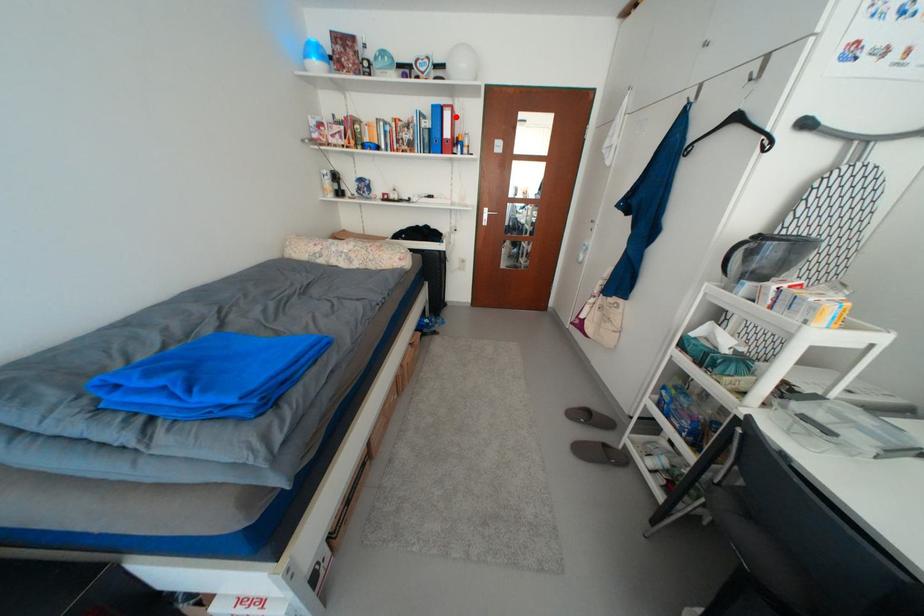
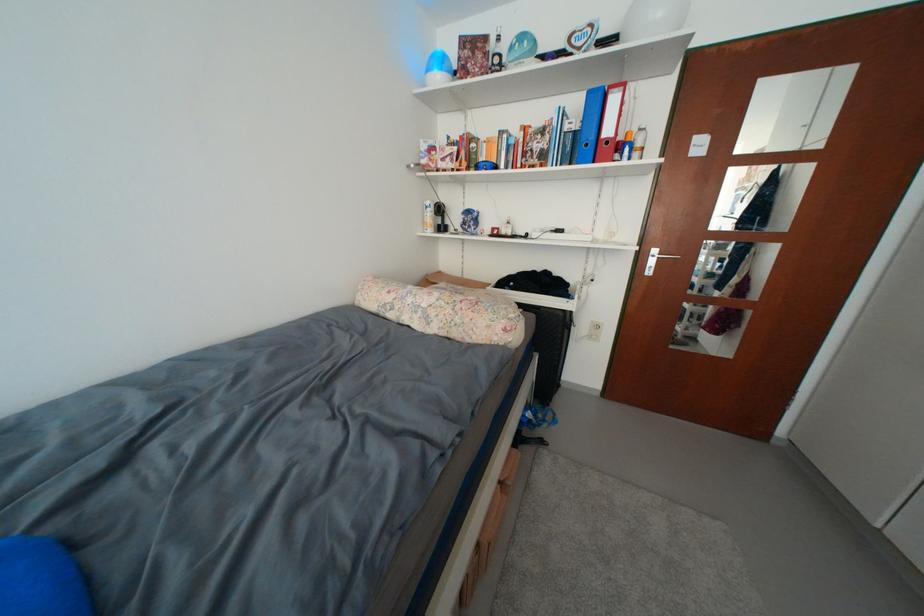
Locate, in the second image, the point that corresponds to the highlighted location in the first image.

(623, 103)